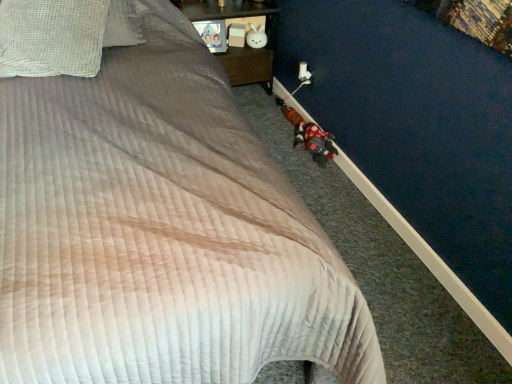
What are the coordinates of `fluffy plush toy at lower right, the first toy viewed from the right` in the screenshot? It's located at (310, 136).

Measure the distance between point (217, 6) and camera.

The distance of point (217, 6) from camera is 2.54 meters.

Locate an element on the screen. The height and width of the screenshot is (384, 512). fluffy plush toy at lower right, the 2th toy viewed from the top is located at coordinates (310, 136).

Is the position of fluffy plush toy at lower right, the first toy in the front-to-back sequence, more distant than that of wooden nightstand at upper center?

No, fluffy plush toy at lower right, the first toy in the front-to-back sequence, is closer to the camera.

Is there a large distance between fluffy plush toy at lower right, the first toy viewed from the right, and wooden nightstand at upper center?

No, there isn't a large distance between fluffy plush toy at lower right, the first toy viewed from the right, and wooden nightstand at upper center.

Is fluffy plush toy at lower right, acting as the 2th toy starting from the back, surrounding wooden nightstand at upper center?

No, wooden nightstand at upper center is not surrounded by fluffy plush toy at lower right, acting as the 2th toy starting from the back.

From the image's perspective, which one is positioned higher, fluffy plush toy at lower right, the 2th toy viewed from the top, or wooden nightstand at upper center?

wooden nightstand at upper center appears higher in the image.

Considering the relative sizes of fluffy plush toy at lower right, marked as the first toy in a bottom-to-top arrangement, and white matte plush rabbit at upper center, which is counted as the first toy, starting from the left, in the image provided, is fluffy plush toy at lower right, marked as the first toy in a bottom-to-top arrangement, wider than white matte plush rabbit at upper center, which is counted as the first toy, starting from the left,?

Yes, fluffy plush toy at lower right, marked as the first toy in a bottom-to-top arrangement, is wider than white matte plush rabbit at upper center, which is counted as the first toy, starting from the left.

Considering the relative positions of fluffy plush toy at lower right, the first toy in the front-to-back sequence, and white matte plush rabbit at upper center, which is counted as the second toy, starting from the right, in the image provided, is fluffy plush toy at lower right, the first toy in the front-to-back sequence, behind white matte plush rabbit at upper center, which is counted as the second toy, starting from the right,?

No.

Could you tell me if fluffy plush toy at lower right, acting as the 2th toy starting from the back, is facing white matte plush rabbit at upper center, which is counted as the second toy, starting from the right?

No, fluffy plush toy at lower right, acting as the 2th toy starting from the back, is not turned towards white matte plush rabbit at upper center, which is counted as the second toy, starting from the right.

Based on the photo, from the image's perspective, would you say fluffy plush toy at lower right, the first toy in the front-to-back sequence, is shown under white matte plush rabbit at upper center, which appears as the 2th toy when viewed from the front?

Yes.

Is white matte plush rabbit at upper center, which is counted as the second toy, starting from the right, wider than wooden nightstand at upper center?

In fact, white matte plush rabbit at upper center, which is counted as the second toy, starting from the right, might be narrower than wooden nightstand at upper center.

In the image, there is a wooden nightstand at upper center. At what (x,y) coordinates should I click in order to perform the action: click on toy above it (from the image's perspective). Please return your answer as a coordinate pair (x, y). The image size is (512, 384). Looking at the image, I should click on (256, 37).

From a real-world perspective, which is physically below, white matte plush rabbit at upper center, which appears as the 2th toy when viewed from the front, or wooden nightstand at upper center?

wooden nightstand at upper center is physically lower.

Consider the image. From the image's perspective, who appears lower, wooden nightstand at upper center or white matte plush rabbit at upper center, which appears as the 2th toy when viewed from the front?

wooden nightstand at upper center is shown below in the image.

Consider the image. Is wooden nightstand at upper center bigger or smaller than white matte plush rabbit at upper center, acting as the 1th toy starting from the top?

Clearly, wooden nightstand at upper center is larger in size than white matte plush rabbit at upper center, acting as the 1th toy starting from the top.

Could you tell me if wooden nightstand at upper center is turned towards white matte plush rabbit at upper center, placed as the 2th toy when sorted from bottom to top?

Yes, wooden nightstand at upper center is aimed at white matte plush rabbit at upper center, placed as the 2th toy when sorted from bottom to top.

In the image, is wooden nightstand at upper center on the left side or the right side of white matte plush rabbit at upper center, which ranks as the 1th toy in back-to-front order?

wooden nightstand at upper center is to the left of white matte plush rabbit at upper center, which ranks as the 1th toy in back-to-front order.

How different are the orientations of white checkered pillow at upper left and wooden nightstand at upper center in degrees?

24.8 degrees.

Is wooden nightstand at upper center a part of white checkered pillow at upper left?

No, wooden nightstand at upper center is located outside of white checkered pillow at upper left.

Can you confirm if white checkered pillow at upper left is positioned to the left of wooden nightstand at upper center?

Correct, you'll find white checkered pillow at upper left to the left of wooden nightstand at upper center.

Which of these two, fluffy plush toy at lower right, arranged as the second toy when viewed from the left, or white checkered pillow at upper left, is smaller?

fluffy plush toy at lower right, arranged as the second toy when viewed from the left.

Does point (285, 107) come in front of point (48, 64)?

No.

Is there a large distance between fluffy plush toy at lower right, marked as the first toy in a bottom-to-top arrangement, and white checkered pillow at upper left?

Yes, fluffy plush toy at lower right, marked as the first toy in a bottom-to-top arrangement, is far from white checkered pillow at upper left.

Is wooden nightstand at upper center positioned far away from fluffy plush toy at lower right, the 2th toy viewed from the top?

Actually, wooden nightstand at upper center and fluffy plush toy at lower right, the 2th toy viewed from the top, are a little close together.

Between wooden nightstand at upper center and fluffy plush toy at lower right, the first toy in the front-to-back sequence, which one has larger size?

wooden nightstand at upper center.

From a real-world perspective, which object rests below the other?

In real-world perspective, fluffy plush toy at lower right, the first toy viewed from the right, is lower.

Image resolution: width=512 pixels, height=384 pixels. Find the location of `furniture above the fluffy plush toy at lower right, the first toy in the front-to-back sequence (from the image's perspective)`. furniture above the fluffy plush toy at lower right, the first toy in the front-to-back sequence (from the image's perspective) is located at coordinates (245, 44).

Locate an element on the screen. Image resolution: width=512 pixels, height=384 pixels. toy above the fluffy plush toy at lower right, the first toy in the front-to-back sequence (from a real-world perspective) is located at coordinates (256, 37).

Looking at the image, which one is located closer to white checkered pillow at upper left, wooden nightstand at upper center or white matte plush rabbit at upper center, acting as the 1th toy starting from the top?

Among the two, wooden nightstand at upper center is located nearer to white checkered pillow at upper left.

From the image, which object appears to be nearer to white matte plush rabbit at upper center, placed as the 2th toy when sorted from bottom to top, white checkered pillow at upper left or wooden nightstand at upper center?

Based on the image, wooden nightstand at upper center appears to be nearer to white matte plush rabbit at upper center, placed as the 2th toy when sorted from bottom to top.

In the scene shown: Estimate the real-world distances between objects in this image. Which object is closer to fluffy plush toy at lower right, the first toy viewed from the right, white matte plush rabbit at upper center, which ranks as the 1th toy in back-to-front order, or wooden nightstand at upper center?

wooden nightstand at upper center is closer to fluffy plush toy at lower right, the first toy viewed from the right.

Estimate the real-world distances between objects in this image. Which object is closer to fluffy plush toy at lower right, the 2th toy viewed from the top, white checkered pillow at upper left or white matte plush rabbit at upper center, acting as the 1th toy starting from the top?

The object closer to fluffy plush toy at lower right, the 2th toy viewed from the top, is white matte plush rabbit at upper center, acting as the 1th toy starting from the top.

Based on their spatial positions, is white checkered pillow at upper left or white matte plush rabbit at upper center, which ranks as the 1th toy in back-to-front order, closer to wooden nightstand at upper center?

white matte plush rabbit at upper center, which ranks as the 1th toy in back-to-front order, is positioned closer to the anchor wooden nightstand at upper center.

Which object lies nearer to the anchor point white checkered pillow at upper left, wooden nightstand at upper center or fluffy plush toy at lower right, the first toy in the front-to-back sequence?

Based on the image, wooden nightstand at upper center appears to be nearer to white checkered pillow at upper left.

Looking at the image, which one is located closer to wooden nightstand at upper center, white matte plush rabbit at upper center, acting as the 1th toy starting from the top, or white checkered pillow at upper left?

white matte plush rabbit at upper center, acting as the 1th toy starting from the top, is positioned closer to the anchor wooden nightstand at upper center.

From the image, which object appears to be nearer to fluffy plush toy at lower right, the first toy in the front-to-back sequence, wooden nightstand at upper center or white checkered pillow at upper left?

The object closer to fluffy plush toy at lower right, the first toy in the front-to-back sequence, is wooden nightstand at upper center.

You are a GUI agent. You are given a task and a screenshot of the screen. Output one action in this format:
    pyautogui.click(x=<x>, y=<y>)
    Task: Click on the furniture located between white checkered pillow at upper left and fluffy plush toy at lower right, marked as the first toy in a bottom-to-top arrangement, in the left-right direction
    
    Given the screenshot: What is the action you would take?
    pyautogui.click(x=245, y=44)

Where is `furniture that lies between white matte plush rabbit at upper center, placed as the 2th toy when sorted from bottom to top, and fluffy plush toy at lower right, the first toy in the front-to-back sequence, from top to bottom`? This screenshot has height=384, width=512. furniture that lies between white matte plush rabbit at upper center, placed as the 2th toy when sorted from bottom to top, and fluffy plush toy at lower right, the first toy in the front-to-back sequence, from top to bottom is located at coordinates (245, 44).

Identify the location of toy between white checkered pillow at upper left and fluffy plush toy at lower right, acting as the 2th toy starting from the back. (256, 37).

This screenshot has height=384, width=512. I want to click on furniture located between white checkered pillow at upper left and white matte plush rabbit at upper center, placed as the 2th toy when sorted from bottom to top, in the depth direction, so click(x=245, y=44).